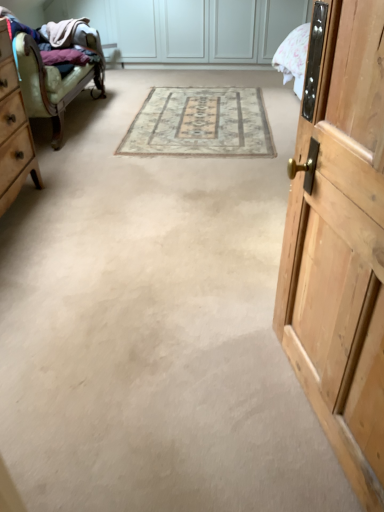
Question: Is leather armchair at left not within wooden door at right?

Choices:
 (A) yes
 (B) no

Answer: (A)

Question: Is leather armchair at left placed right next to wooden door at right?

Choices:
 (A) yes
 (B) no

Answer: (B)

Question: Does leather armchair at left have a greater width compared to wooden door at right?

Choices:
 (A) no
 (B) yes

Answer: (B)

Question: Considering the relative sizes of leather armchair at left and wooden door at right in the image provided, is leather armchair at left taller than wooden door at right?

Choices:
 (A) yes
 (B) no

Answer: (B)

Question: From a real-world perspective, is leather armchair at left positioned over wooden door at right based on gravity?

Choices:
 (A) no
 (B) yes

Answer: (A)

Question: Does leather armchair at left appear on the right side of wooden door at right?

Choices:
 (A) no
 (B) yes

Answer: (A)

Question: Is wooden dresser at left at the back of leather armchair at left?

Choices:
 (A) yes
 (B) no

Answer: (B)

Question: Is leather armchair at left wider than wooden dresser at left?

Choices:
 (A) no
 (B) yes

Answer: (B)

Question: Is wooden dresser at left a part of leather armchair at left?

Choices:
 (A) yes
 (B) no

Answer: (B)

Question: Does leather armchair at left have a lesser height compared to wooden dresser at left?

Choices:
 (A) no
 (B) yes

Answer: (B)

Question: From a real-world perspective, is leather armchair at left beneath wooden dresser at left?

Choices:
 (A) no
 (B) yes

Answer: (B)

Question: From the image's perspective, is leather armchair at left located above wooden dresser at left?

Choices:
 (A) no
 (B) yes

Answer: (B)

Question: Can you confirm if wooden door at right is taller than beige carpet at center?

Choices:
 (A) yes
 (B) no

Answer: (A)